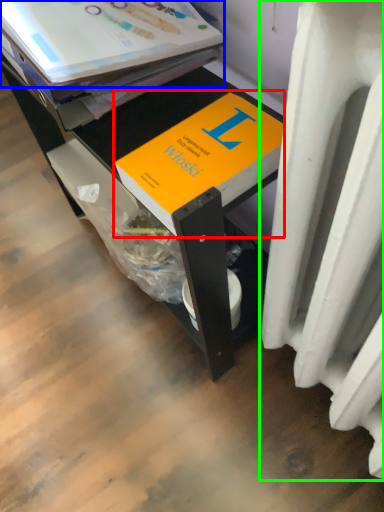
Question: Which is farther away from book (highlighted by a red box)? paperback book (highlighted by a blue box) or heater (highlighted by a green box)?

Choices:
 (A) paperback book
 (B) heater

Answer: (B)